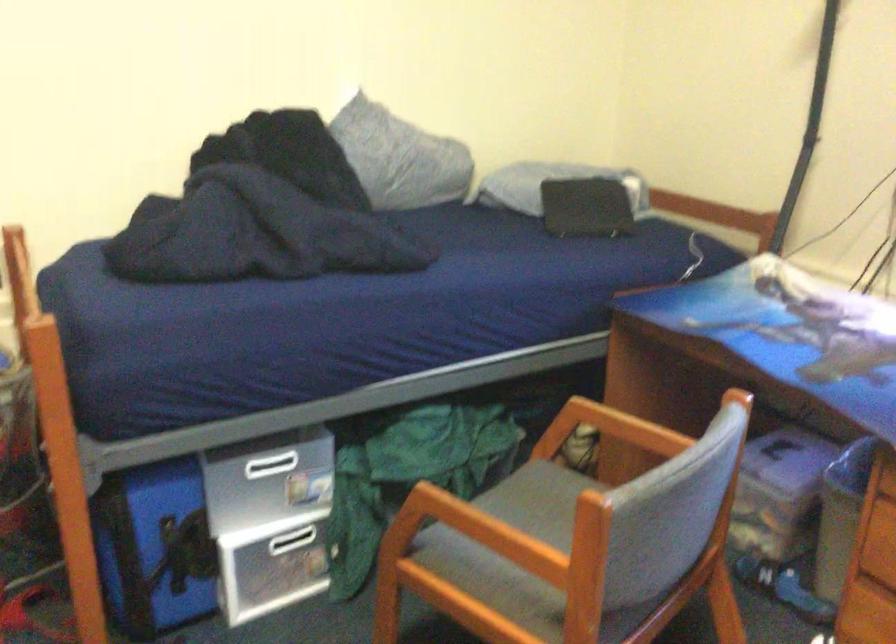
Image resolution: width=896 pixels, height=644 pixels. What do you see at coordinates (540, 500) in the screenshot?
I see `the chair sitting surface` at bounding box center [540, 500].